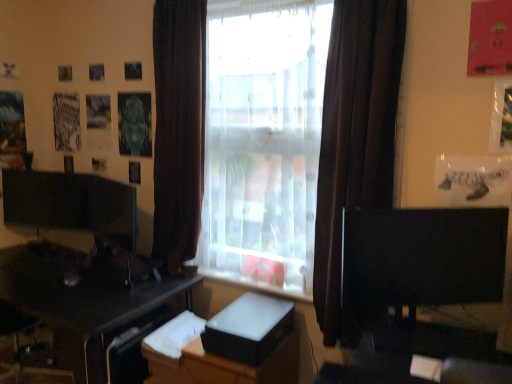
Question: Is black glossy desk at lower left in front of or behind white glossy dresser at center in the image?

Choices:
 (A) front
 (B) behind

Answer: (A)

Question: Based on their sizes in the image, would you say black glossy desk at lower left is bigger or smaller than white glossy dresser at center?

Choices:
 (A) big
 (B) small

Answer: (A)

Question: Which is nearer to the transparent glass window at center?

Choices:
 (A) brown fabric curtain at center, which appears as the 2th curtain when viewed from the right
 (B) matte black monitor at left, arranged as the second computer monitor when viewed from the right
 (C) translucent fabric window at center
 (D) black matte computer monitor at right, the 2th computer monitor from the left
 (E) white glossy dresser at center

Answer: (A)

Question: Based on their relative distances, which object is nearer to the white matte cardboard box at center?

Choices:
 (A) white glossy dresser at center
 (B) transparent glass window at center
 (C) translucent fabric window at center
 (D) black matte computer monitor at right, the 2th computer monitor from the left
 (E) brown fabric curtain at center, which ranks as the 1th curtain in left-to-right order

Answer: (A)